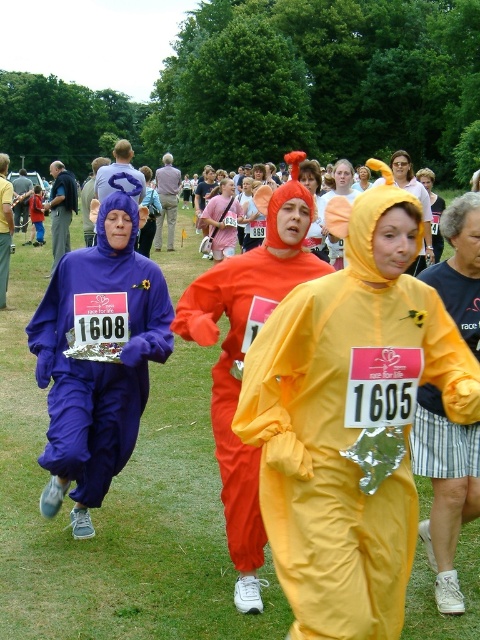
Is yellow shiny raincoat at center smaller than orange fabric costume at center?

Yes.

Does yellow shiny raincoat at center have a greater height compared to orange fabric costume at center?

Incorrect, yellow shiny raincoat at center's height is not larger of orange fabric costume at center's.

At what (x,y) coordinates should I click in order to perform the action: click on yellow shiny raincoat at center. Please return your answer as a coordinate pair (x, y). Looking at the image, I should click on (350, 420).

In the scene shown: Who is lower down, purple matte jumpsuit at left or orange fabric costume at center?

purple matte jumpsuit at left is lower down.

Is point (52, 378) positioned after point (164, 202)?

No, (52, 378) is closer to viewer.

I want to click on purple matte jumpsuit at left, so click(x=98, y=353).

Can you confirm if yellow shiny raincoat at center is taller than matte purple costume at left?

No.

Does point (388, 460) come in front of point (60, 236)?

Yes, it is in front of point (60, 236).

Identify the location of yellow shiny raincoat at center. The image size is (480, 640). (350, 420).